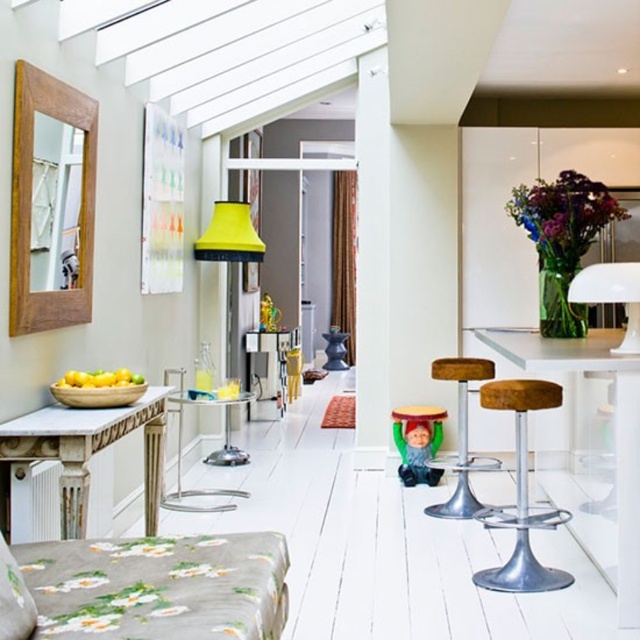
You are standing in the room and see the point marked at coordinates (228, 236). What object is located at this point?

The yellow fabric lampshade at center is located at point (228, 236).

You are standing at the center of the room and want to sit down. There is a metallic silver bar stool at right located at point (522, 493). Can you walk directly to it without moving around any furniture?

The metallic silver bar stool at right is located at point (522, 493). Since there is no mention of furniture blocking the path in the scene description, you can likely walk directly to it.